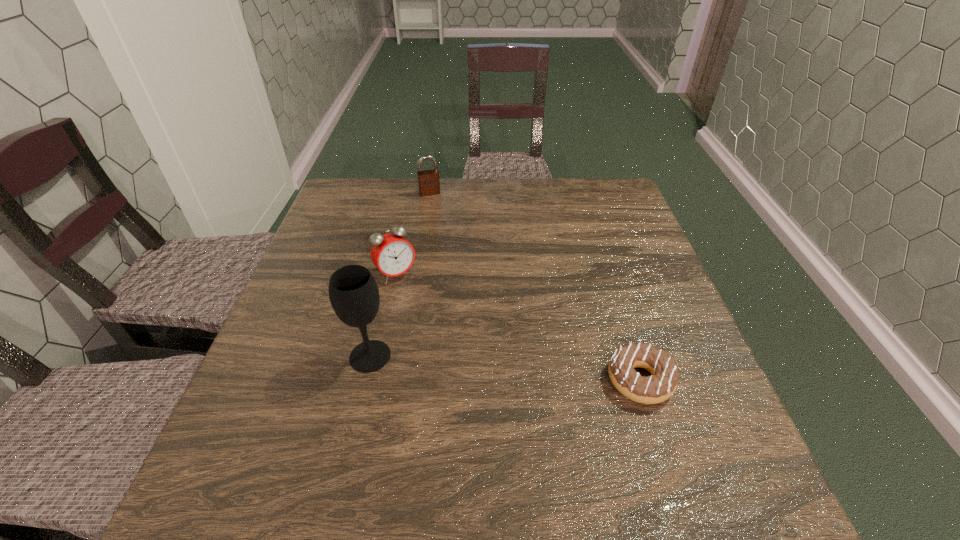
In order to click on vacant spot on the desktop that is between the tallest object and the shortest object and is positioned on the front-facing side of the third nearest object in this screenshot , I will do `click(463, 364)`.

The height and width of the screenshot is (540, 960). In order to click on vacant spot on the desktop that is between the wineglass and the shortest object and is positioned on the front-facing side of the padlock in this screenshot , I will do `click(494, 367)`.